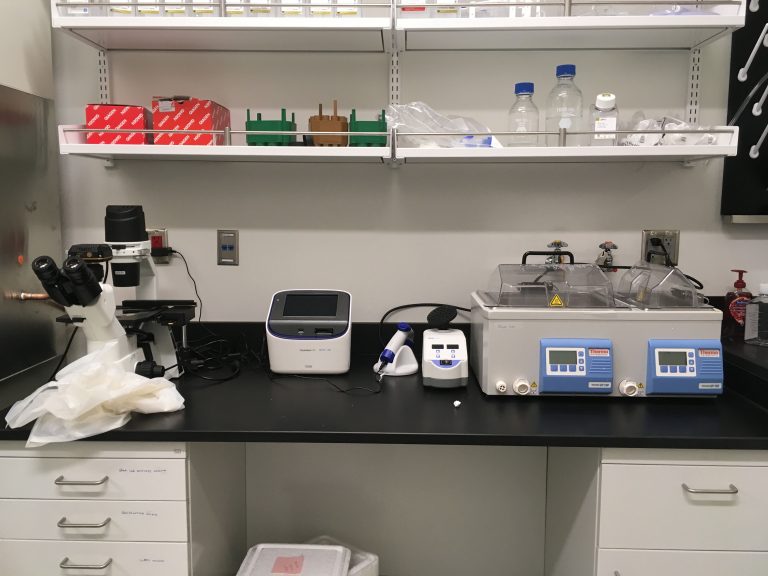
Identify the location of shelving brackets. (100, 74), (392, 79), (693, 93).